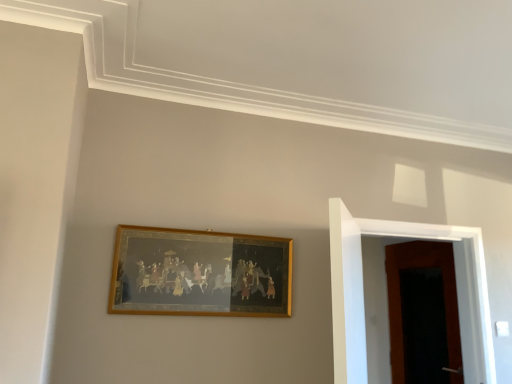
At what (x,y) coordinates should I click in order to perform the action: click on wooden door at right, positioned as the first door in back-to-front order. Please return your answer as a coordinate pair (x, y). Image resolution: width=512 pixels, height=384 pixels. Looking at the image, I should click on (423, 313).

Where is `gold-framed painting at center`? gold-framed painting at center is located at coordinates (200, 273).

What is the approximate width of wooden door at right, which is the second door in back-to-front order?

7.96 inches.

What do you see at coordinates (362, 291) in the screenshot? I see `wooden door at right, which appears as the first door when viewed from the front` at bounding box center [362, 291].

The image size is (512, 384). Identify the location of wooden door at right, positioned as the first door in back-to-front order. (423, 313).

Which is more distant, (450, 225) or (131, 288)?

The point (450, 225) is more distant.

Considering the relative sizes of wooden door at right, which is the second door in back-to-front order, and gold-framed painting at center in the image provided, is wooden door at right, which is the second door in back-to-front order, bigger than gold-framed painting at center?

Yes, wooden door at right, which is the second door in back-to-front order, is bigger than gold-framed painting at center.

Consider the image. Is wooden door at right, which is the second door in back-to-front order, in front of or behind gold-framed painting at center in the image?

In the image, wooden door at right, which is the second door in back-to-front order, appears behind gold-framed painting at center.

Can we say wooden door at right, which appears as the first door when viewed from the front, lies outside gold-framed painting at center?

That's correct, wooden door at right, which appears as the first door when viewed from the front, is outside of gold-framed painting at center.

Considering the relative sizes of wooden door at right, positioned as the first door in back-to-front order, and gold-framed painting at center in the image provided, is wooden door at right, positioned as the first door in back-to-front order, wider than gold-framed painting at center?

No.

From the image's perspective, relative to gold-framed painting at center, is wooden door at right, which appears as the 2th door when viewed from the front, above or below?

Clearly, from the image's perspective, wooden door at right, which appears as the 2th door when viewed from the front, is below gold-framed painting at center.

From a real-world perspective, who is located higher, wooden door at right, which appears as the 2th door when viewed from the front, or gold-framed painting at center?

In real-world perspective, gold-framed painting at center is above.

Considering the relative positions of wooden door at right, which appears as the 2th door when viewed from the front, and gold-framed painting at center in the image provided, is wooden door at right, which appears as the 2th door when viewed from the front, to the left of gold-framed painting at center from the viewer's perspective?

Incorrect, wooden door at right, which appears as the 2th door when viewed from the front, is not on the left side of gold-framed painting at center.

Can we say gold-framed painting at center lies outside wooden door at right, which is the second door in back-to-front order?

Absolutely, gold-framed painting at center is external to wooden door at right, which is the second door in back-to-front order.

Is gold-framed painting at center next to wooden door at right, which is the second door in back-to-front order, and touching it?

They are not placed beside each other.

Considering the points (220, 291) and (480, 265), which point is behind, point (220, 291) or point (480, 265)?

The point (480, 265) is farther from the camera.

Are gold-framed painting at center and wooden door at right, which appears as the 2th door when viewed from the front, making contact?

No, gold-framed painting at center is not with wooden door at right, which appears as the 2th door when viewed from the front.

From the picture: Which is correct: gold-framed painting at center is inside wooden door at right, which appears as the 2th door when viewed from the front, or outside of it?

gold-framed painting at center is outside wooden door at right, which appears as the 2th door when viewed from the front.

How far apart are gold-framed painting at center and wooden door at right, which appears as the 2th door when viewed from the front?

gold-framed painting at center and wooden door at right, which appears as the 2th door when viewed from the front, are 7.15 feet apart from each other.

Which of these two, gold-framed painting at center or wooden door at right, which appears as the 2th door when viewed from the front, is wider?

With larger width is gold-framed painting at center.

Considering the positions of objects wooden door at right, which appears as the first door when viewed from the front, and wooden door at right, which appears as the 2th door when viewed from the front, in the image provided, who is behind, wooden door at right, which appears as the first door when viewed from the front, or wooden door at right, which appears as the 2th door when viewed from the front,?

wooden door at right, which appears as the 2th door when viewed from the front, is more distant.

Considering the relative positions of wooden door at right, which appears as the first door when viewed from the front, and wooden door at right, positioned as the first door in back-to-front order, in the image provided, is wooden door at right, which appears as the first door when viewed from the front, to the left of wooden door at right, positioned as the first door in back-to-front order, from the viewer's perspective?

Yes, wooden door at right, which appears as the first door when viewed from the front, is to the left of wooden door at right, positioned as the first door in back-to-front order.

Locate an element on the screen. This screenshot has width=512, height=384. door located on the left of wooden door at right, positioned as the first door in back-to-front order is located at coordinates (362, 291).

Is wooden door at right, which appears as the 2th door when viewed from the front, turned away from wooden door at right, which is the second door in back-to-front order?

wooden door at right, which appears as the 2th door when viewed from the front, does not have its back to wooden door at right, which is the second door in back-to-front order.

Is wooden door at right, positioned as the first door in back-to-front order, not inside wooden door at right, which is the second door in back-to-front order?

wooden door at right, positioned as the first door in back-to-front order, lies outside wooden door at right, which is the second door in back-to-front order,'s area.

In the scene shown: From their relative heights in the image, would you say wooden door at right, positioned as the first door in back-to-front order, is taller or shorter than wooden door at right, which appears as the first door when viewed from the front?

In the image, wooden door at right, positioned as the first door in back-to-front order, appears to be taller than wooden door at right, which appears as the first door when viewed from the front.

Find the location of a particular element. This screenshot has height=384, width=512. picture frame that appears on the left of wooden door at right, which is the second door in back-to-front order is located at coordinates (200, 273).

Find the location of a particular element. the 2nd door behind the gold-framed painting at center, starting your count from the anchor is located at coordinates (423, 313).

Looking at the image, which one is located closer to wooden door at right, which appears as the first door when viewed from the front, gold-framed painting at center or wooden door at right, positioned as the first door in back-to-front order?

Based on the image, gold-framed painting at center appears to be nearer to wooden door at right, which appears as the first door when viewed from the front.

When comparing their distances from gold-framed painting at center, does wooden door at right, which appears as the first door when viewed from the front, or wooden door at right, which appears as the 2th door when viewed from the front, seem closer?

The object closer to gold-framed painting at center is wooden door at right, which appears as the first door when viewed from the front.

Considering their positions, is gold-framed painting at center positioned further to wooden door at right, which appears as the 2th door when viewed from the front, than wooden door at right, which appears as the first door when viewed from the front?

Based on the image, gold-framed painting at center appears to be further to wooden door at right, which appears as the 2th door when viewed from the front.

Estimate the real-world distances between objects in this image. Which object is further from wooden door at right, which appears as the 2th door when viewed from the front, wooden door at right, which appears as the first door when viewed from the front, or gold-framed painting at center?

Based on the image, gold-framed painting at center appears to be further to wooden door at right, which appears as the 2th door when viewed from the front.

Considering their positions, is wooden door at right, positioned as the first door in back-to-front order, positioned closer to wooden door at right, which is the second door in back-to-front order, than gold-framed painting at center?

gold-framed painting at center.

Estimate the real-world distances between objects in this image. Which object is further from gold-framed painting at center, wooden door at right, positioned as the first door in back-to-front order, or wooden door at right, which appears as the first door when viewed from the front?

wooden door at right, positioned as the first door in back-to-front order, lies further to gold-framed painting at center than the other object.

Identify the location of door between gold-framed painting at center and wooden door at right, positioned as the first door in back-to-front order, in the horizontal direction. (362, 291).